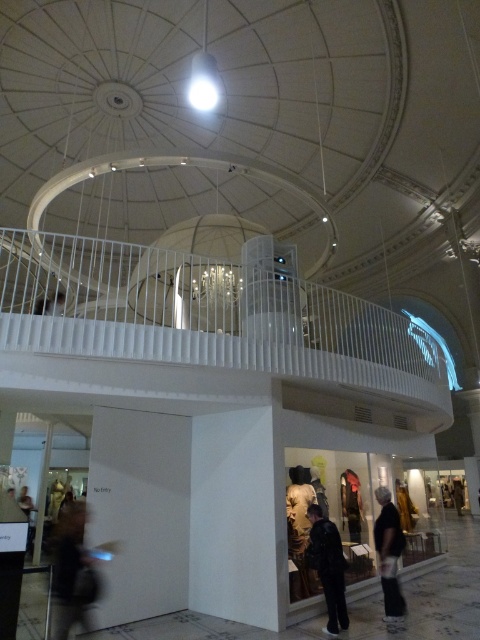
You are standing in the museum and want to pick up both items. Which item should you reach for first, the dark gray backpack at lower left or the dark gray fabric jacket at lower center?

The dark gray backpack at lower left is closer to you, so you should reach for it first.

You are standing on the balcony with a white railing that overlooks the main exhibition area. You see a dark gray backpack at lower left. Based on the coordinates provided, where is the dark gray backpack located in relation to your position on the balcony?

The dark gray backpack at lower left is located at coordinates point (72, 570), which places it in the lower left area of the image, meaning it is positioned to the left and below your current position on the balcony.

You are an exhibit organizer who needs to place a third jacket between the black leather jacket at lower center and the dark gray fabric jacket at lower center. Based on their widths, which side should you place it on to maintain even spacing?

The black leather jacket at lower center might be wider than dark gray fabric jacket at lower center, so placing the third jacket next to the darker gray fabric jacket at lower center would help maintain even spacing.